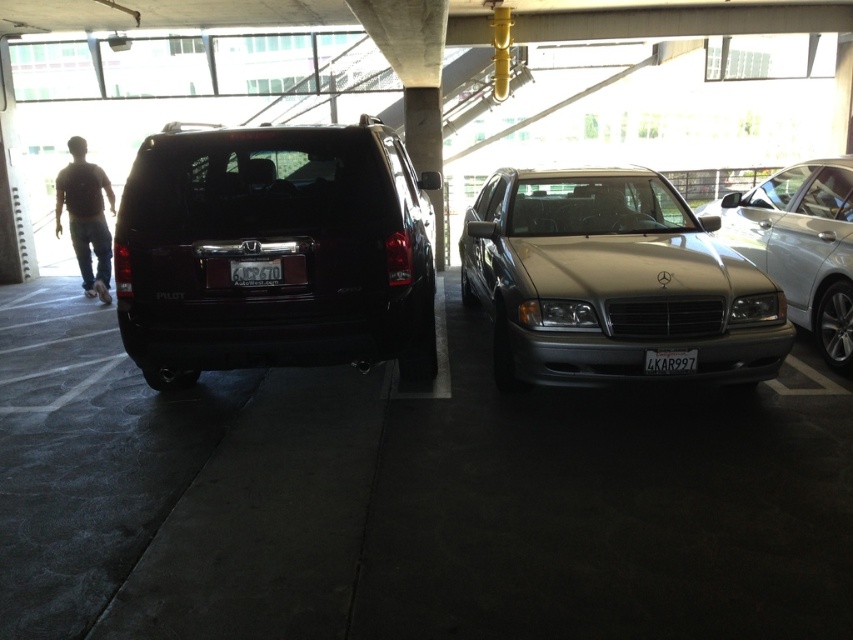
Is brown cotton shirt at left shorter than red plastic license plate at rear center?

No, brown cotton shirt at left is not shorter than red plastic license plate at rear center.

Is point (80, 188) more distant than point (236, 269)?

Yes, point (80, 188) is farther from viewer.

Locate an element on the screen. brown cotton shirt at left is located at coordinates (85, 216).

Can you confirm if satin silver sedan at center is taller than brown cotton shirt at left?

In fact, satin silver sedan at center may be shorter than brown cotton shirt at left.

Is point (717, 269) less distant than point (102, 273)?

Yes, point (717, 269) is closer to viewer.

Where is `satin silver sedan at center`? satin silver sedan at center is located at coordinates (611, 282).

Which of these two, matte black suv at center or black plastic license plate at center, stands taller?

Standing taller between the two is matte black suv at center.

In the scene shown: Is matte black suv at center positioned at the back of black plastic license plate at center?

No, matte black suv at center is in front of black plastic license plate at center.

Is point (183, 141) closer to viewer compared to point (669, 349)?

No, (183, 141) is further to viewer.

You are a GUI agent. You are given a task and a screenshot of the screen. Output one action in this format:
    pyautogui.click(x=<x>, y=<y>)
    Task: Click on the matte black suv at center
    The height and width of the screenshot is (640, 853).
    Given the screenshot: What is the action you would take?
    tap(274, 252)